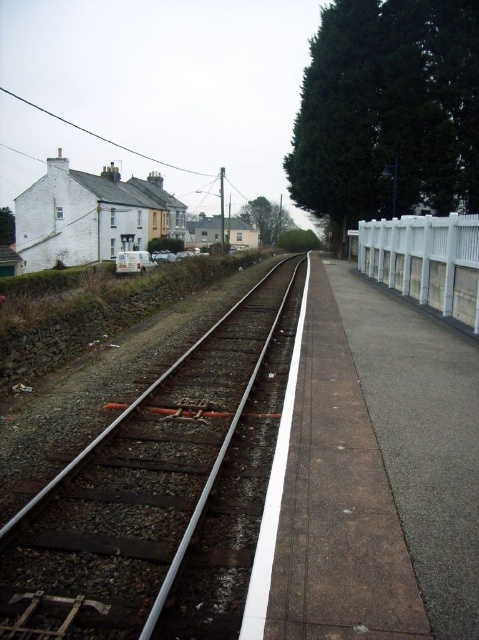
You are a delivery person trying to cross the railway tracks safely. You see the rusty metal train track at center and the white plastic fence at right. Which object should you avoid stepping on to stay safe?

You should avoid stepping on the rusty metal train track at center because it is positioned on the left side of the white plastic fence at right, meaning the tracks are where trains travel and stepping on them could be dangerous.

You are a maintenance worker needing to inspect both the rusty metal train track at center and the white plastic fence at right. Based on their positions, which object is closer to the ground?

The rusty metal train track at center is located below the white plastic fence at right, so the rusty metal train track at center is closer to the ground.

You are standing at the point labeled point [73,490]. You want to walk to the nearest railway track. How far will you have to walk?

You will have to walk 6.07 meters to reach the nearest railway track from the point labeled point [73,490].